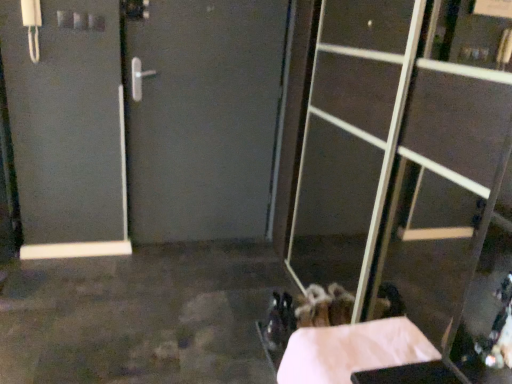
Question: Does transparent glass door at right have a lesser height compared to white paper at lower right?

Choices:
 (A) no
 (B) yes

Answer: (A)

Question: Is transparent glass door at right to the left of white paper at lower right from the viewer's perspective?

Choices:
 (A) no
 (B) yes

Answer: (A)

Question: From the image's perspective, is transparent glass door at right over white paper at lower right?

Choices:
 (A) no
 (B) yes

Answer: (B)

Question: Is transparent glass door at right far away from white paper at lower right?

Choices:
 (A) no
 (B) yes

Answer: (B)

Question: Does transparent glass door at right have a smaller size compared to white paper at lower right?

Choices:
 (A) yes
 (B) no

Answer: (B)

Question: Does transparent glass door at right come behind white paper at lower right?

Choices:
 (A) no
 (B) yes

Answer: (A)

Question: From the image's perspective, is white paper at lower right located beneath transparent glass door at right?

Choices:
 (A) yes
 (B) no

Answer: (A)

Question: Can you see white paper at lower right touching transparent glass door at right?

Choices:
 (A) no
 (B) yes

Answer: (A)

Question: Is white paper at lower right at the right side of transparent glass door at right?

Choices:
 (A) yes
 (B) no

Answer: (B)

Question: From a real-world perspective, is white paper at lower right physically above transparent glass door at right?

Choices:
 (A) yes
 (B) no

Answer: (B)

Question: Can you confirm if white paper at lower right is bigger than transparent glass door at right?

Choices:
 (A) yes
 (B) no

Answer: (B)

Question: Is white paper at lower right positioned behind transparent glass door at right?

Choices:
 (A) no
 (B) yes

Answer: (B)

Question: Is white paper at lower right in front of or behind transparent glass door at right in the image?

Choices:
 (A) front
 (B) behind

Answer: (B)